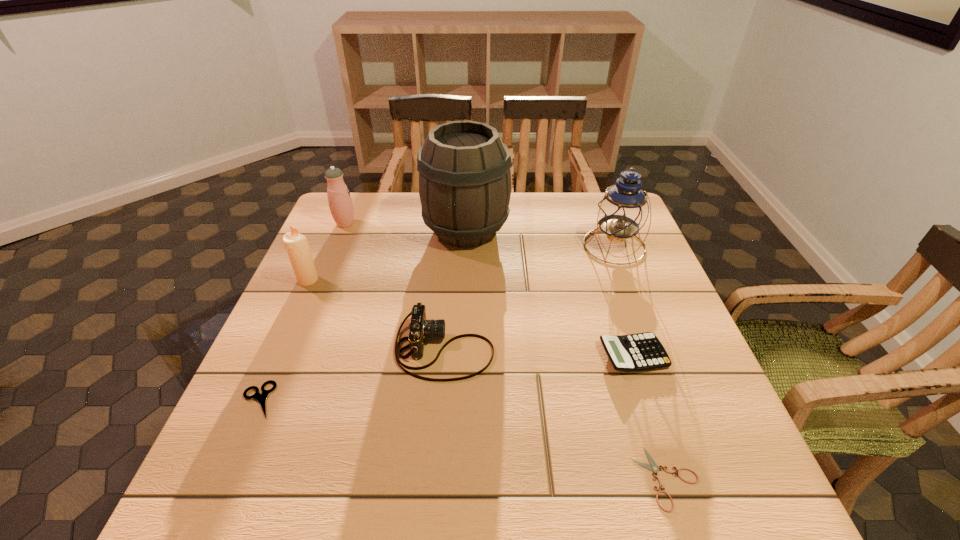
Where is `object situated at the near right corner`? The width and height of the screenshot is (960, 540). object situated at the near right corner is located at coordinates (653, 467).

At what (x,y) coordinates should I click in order to perform the action: click on free space at the far edge of the desktop. Please return your answer as a coordinate pair (x, y). The height and width of the screenshot is (540, 960). Looking at the image, I should click on (554, 219).

This screenshot has height=540, width=960. In order to click on free space at the near edge of the desktop in this screenshot , I will do `click(664, 505)`.

In the image, there is a desktop. Where is `vacant space at the left edge`? vacant space at the left edge is located at coordinates (289, 434).

Locate an element on the screen. Image resolution: width=960 pixels, height=540 pixels. free location at the right edge is located at coordinates (643, 261).

At what (x,y) coordinates should I click in order to perform the action: click on free space at the far right corner of the desktop. Please return your answer as a coordinate pair (x, y). Looking at the image, I should click on 598,204.

Where is `vacant space that is in between the tallest object and the lantern`? This screenshot has width=960, height=540. vacant space that is in between the tallest object and the lantern is located at coordinates (540, 238).

At what (x,y) coordinates should I click in order to perform the action: click on vacant area between the second tallest object and the fifth tallest object. Please return your answer as a coordinate pair (x, y). The height and width of the screenshot is (540, 960). Looking at the image, I should click on (529, 297).

This screenshot has height=540, width=960. I want to click on vacant region between the farther shears and the fifth tallest object, so click(351, 374).

Where is `blank region between the fourth shortest object and the thermos bottle`? blank region between the fourth shortest object and the thermos bottle is located at coordinates (395, 286).